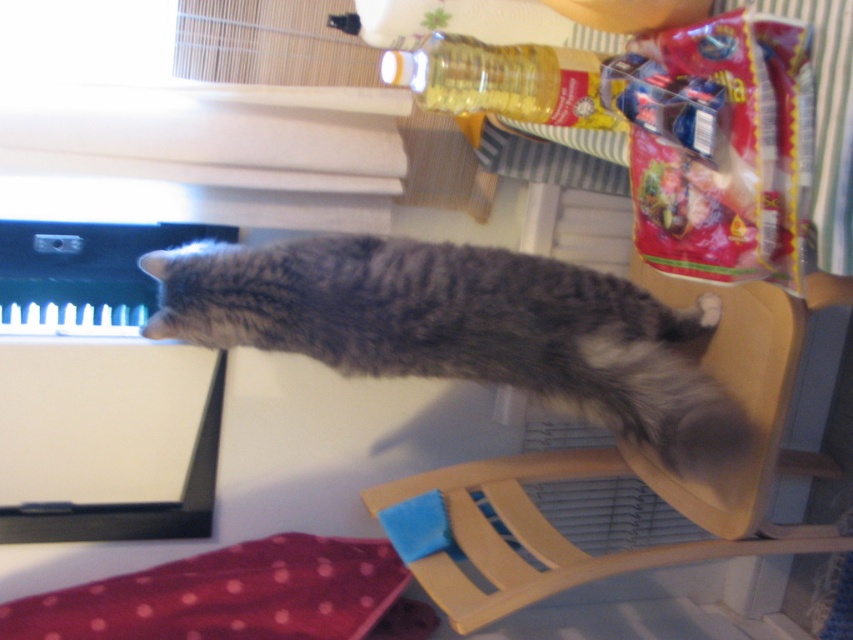
You are a photographer trying to capture the gray fluffy cat at center and the wooden chair at upper right. Based on their positions, which object is closer to the camera?

The gray fluffy cat at center is positioned over the wooden chair at upper right, meaning it is closer to the camera.

From the picture: You are standing in the room and want to place a small decoration between the two points, point (x=788, y=532) and point (x=625, y=67). Based on their positions, which point is closer to you so that I can place the decoration in front of it?

Point (x=625, y=67) is closer to you, so place the decoration in front of point (x=625, y=67).